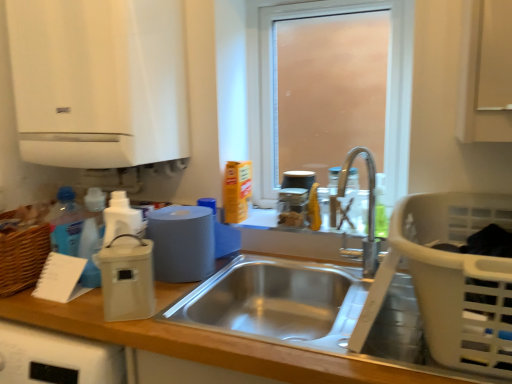
Question: Considering the positions of translucent plastic soap dispenser at upper right, acting as the 2th bottle starting from the left, and stainless steel sink at center in the image, is translucent plastic soap dispenser at upper right, acting as the 2th bottle starting from the left, taller or shorter than stainless steel sink at center?

Choices:
 (A) short
 (B) tall

Answer: (B)

Question: From the image's perspective, is translucent plastic soap dispenser at upper right, the first bottle viewed from the right, above or below stainless steel sink at center?

Choices:
 (A) below
 (B) above

Answer: (B)

Question: Which object is positioned farthest from the frosted glass window at center?

Choices:
 (A) beige plastic container at left, the 1th appliance positioned from the left
 (B) wooden at left
 (C) translucent plastic soap dispenser at upper right, the first bottle viewed from the right
 (D) stainless steel sink at center
 (E) white plastic laundry basket at lower right

Answer: (A)

Question: Which is nearer to the stainless steel sink at center?

Choices:
 (A) translucent plastic soap dispenser at upper right, acting as the 2th bottle starting from the left
 (B) beige plastic container at left, the 1th appliance positioned from the left
 (C) white plastic laundry basket at lower right
 (D) translucent glass jars at upper center, acting as the third appliance starting from the left
 (E) frosted glass window at center

Answer: (D)